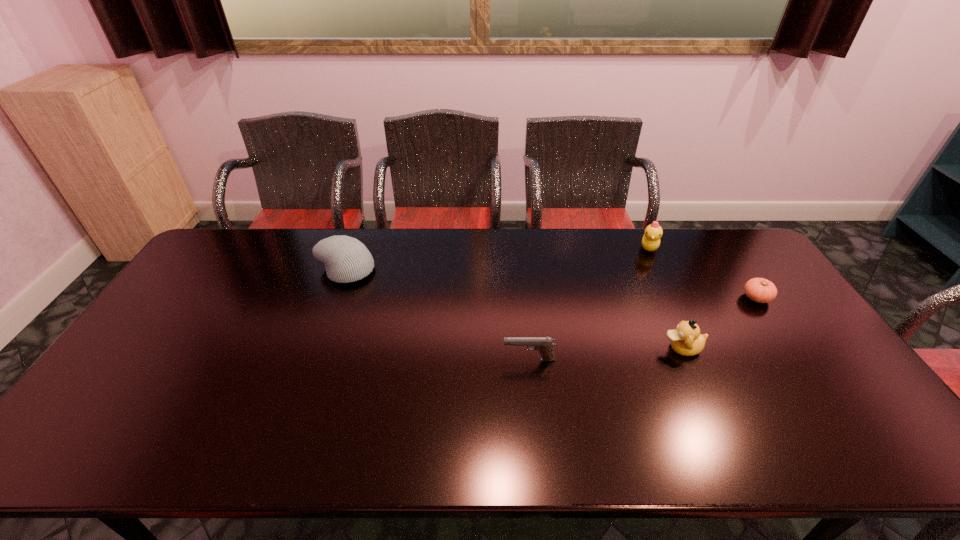
At what (x,y) coordinates should I click in order to perform the action: click on free spot at the near edge of the desktop. Please return your answer as a coordinate pair (x, y). Looking at the image, I should click on (254, 427).

Identify the location of free space at the left edge. (137, 352).

In the image, there is a desktop. Identify the location of vacant space at the right edge. The height and width of the screenshot is (540, 960). (794, 321).

Locate an element on the screen. The width and height of the screenshot is (960, 540). free location at the far left corner is located at coordinates (238, 239).

Find the location of a particular element. vacant space at the far right corner of the desktop is located at coordinates (732, 241).

Where is `vacant space that is in between the beanie and the nearer duckling`? vacant space that is in between the beanie and the nearer duckling is located at coordinates (514, 309).

This screenshot has width=960, height=540. Identify the location of free space between the nearer duckling and the farther duckling. (665, 298).

The image size is (960, 540). I want to click on blank region between the leftmost object and the third nearest object, so click(x=551, y=284).

Where is `free point between the nearer duckling and the farther duckling`? The height and width of the screenshot is (540, 960). free point between the nearer duckling and the farther duckling is located at coordinates (665, 298).

Where is `vacant region between the farther duckling and the rightmost object`? vacant region between the farther duckling and the rightmost object is located at coordinates (703, 273).